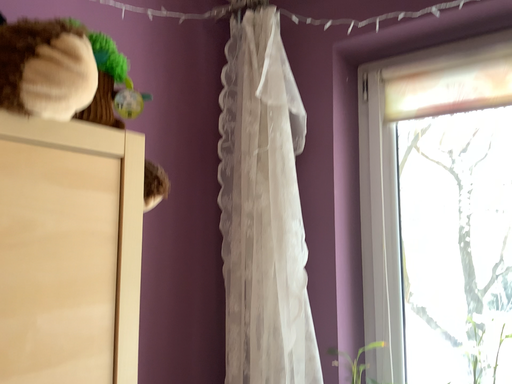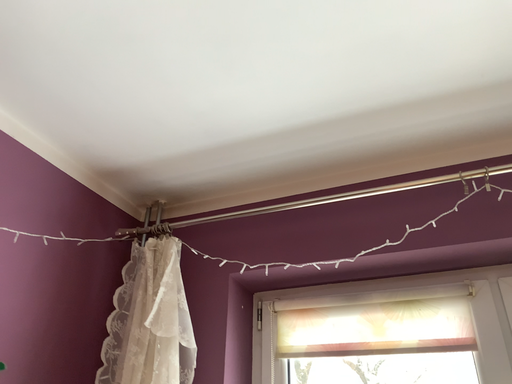
Question: Which way did the camera rotate in the video?

Choices:
 (A) rotated upward
 (B) rotated downward

Answer: (A)